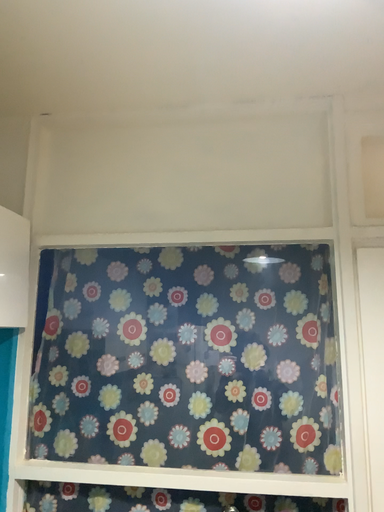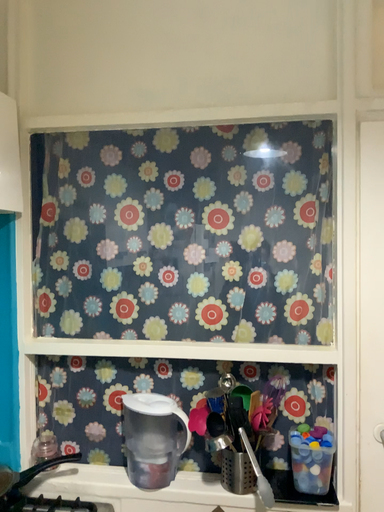
Question: Which way did the camera rotate in the video?

Choices:
 (A) rotated upward
 (B) rotated downward

Answer: (B)